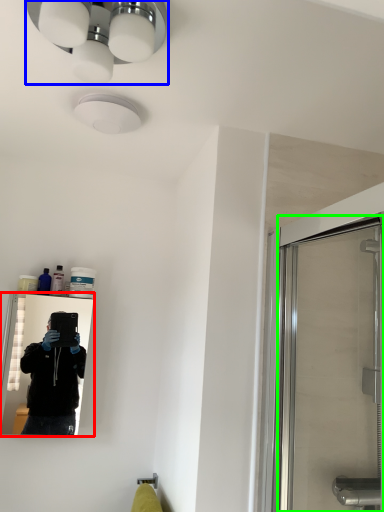
Question: Which is nearer to the mirror (highlighted by a red box)? light fixture (highlighted by a blue box) or screen door (highlighted by a green box).

Choices:
 (A) light fixture
 (B) screen door

Answer: (B)